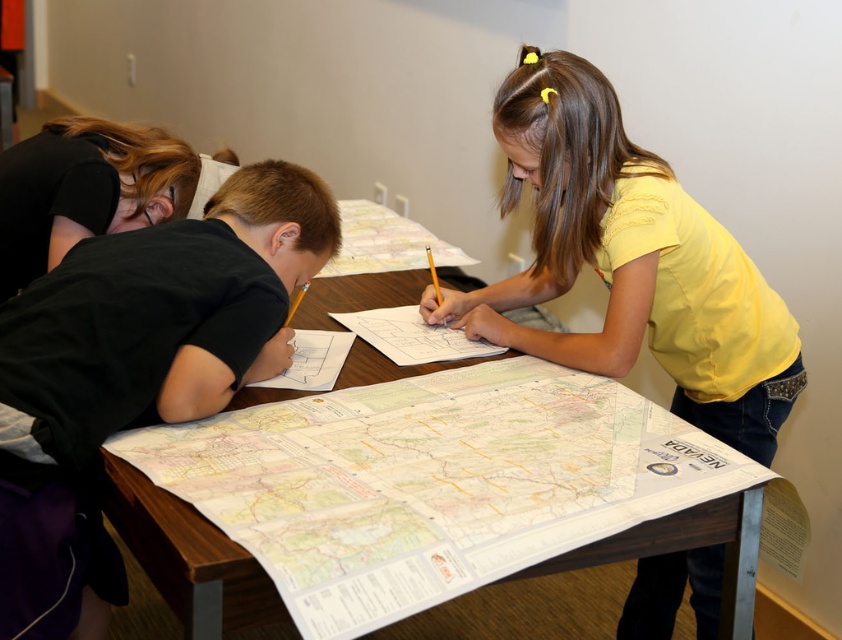
Question: Which point appears farthest from the camera in this image?

Choices:
 (A) (368, 276)
 (B) (601, 161)
 (C) (102, 378)

Answer: (A)

Question: Observing the image, what is the correct spatial positioning of black matte shirt at left in reference to wooden table at center?

Choices:
 (A) above
 (B) below

Answer: (B)

Question: Among these objects, which one is farthest from the camera?

Choices:
 (A) black matte shirt at left
 (B) wooden table at center

Answer: (B)

Question: Which point is closer to the camera?

Choices:
 (A) (301, 244)
 (B) (552, 208)

Answer: (A)

Question: Is black matte shirt at left to the left of wooden table at center from the viewer's perspective?

Choices:
 (A) yes
 (B) no

Answer: (A)

Question: Is yellow cotton shirt at center smaller than wooden table at center?

Choices:
 (A) yes
 (B) no

Answer: (A)